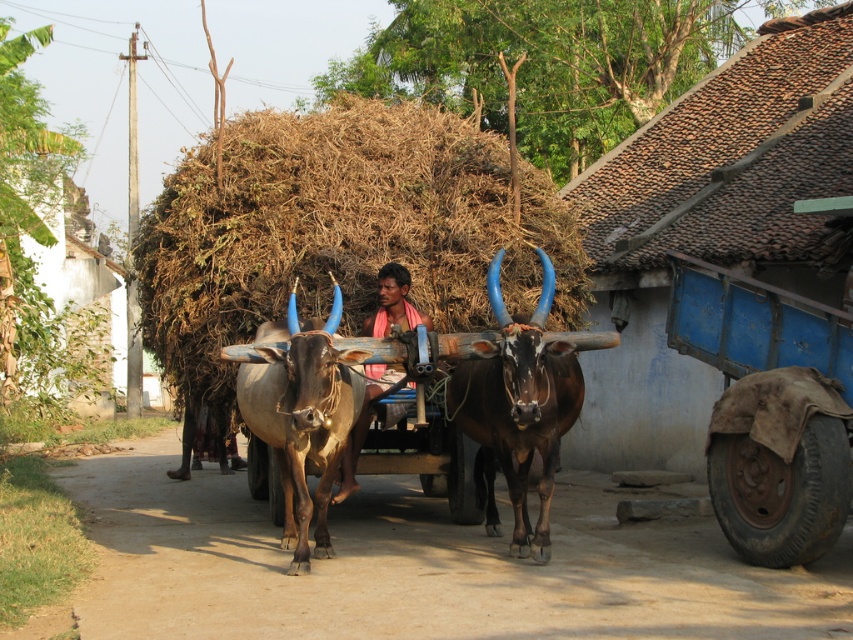
Question: Can you confirm if shiny brown bull at center is positioned below brown glossy bull at center?

Choices:
 (A) no
 (B) yes

Answer: (A)

Question: Is brown/dry grass at center bigger than brown glossy bull at center?

Choices:
 (A) yes
 (B) no

Answer: (B)

Question: Is shiny brown bull at center further to camera compared to brown glossy bull at center?

Choices:
 (A) no
 (B) yes

Answer: (B)

Question: Which point is closer to the camera?

Choices:
 (A) pink fabric at center
 (B) brown/dry grass at center

Answer: (A)

Question: Which point is closer to the camera?

Choices:
 (A) (425, 316)
 (B) (247, 400)

Answer: (B)

Question: Which point is closer to the camera taking this photo?

Choices:
 (A) (326, 465)
 (B) (512, 353)
 (C) (486, 150)

Answer: (B)